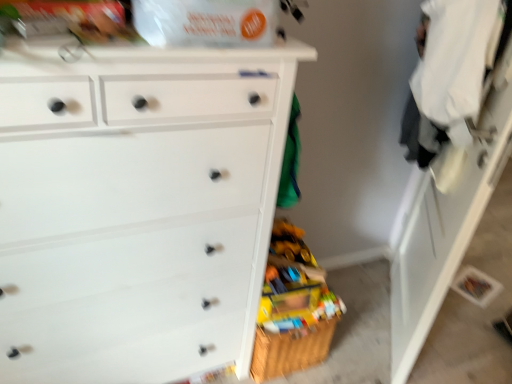
Question: In the image, is white glossy cabinet at right positioned in front of or behind white matte chest of drawers at left?

Choices:
 (A) front
 (B) behind

Answer: (B)

Question: Does point (428, 311) appear closer or farther from the camera than point (16, 54)?

Choices:
 (A) closer
 (B) farther

Answer: (B)

Question: Considering the relative positions of white glossy cabinet at right and white matte chest of drawers at left in the image provided, is white glossy cabinet at right to the left or to the right of white matte chest of drawers at left?

Choices:
 (A) left
 (B) right

Answer: (B)

Question: Considering the positions of white matte chest of drawers at left and white glossy cabinet at right in the image, is white matte chest of drawers at left bigger or smaller than white glossy cabinet at right?

Choices:
 (A) big
 (B) small

Answer: (A)

Question: Is white matte chest of drawers at left inside or outside of white glossy cabinet at right?

Choices:
 (A) outside
 (B) inside

Answer: (A)

Question: Considering the positions of white matte chest of drawers at left and white glossy cabinet at right in the image, is white matte chest of drawers at left taller or shorter than white glossy cabinet at right?

Choices:
 (A) short
 (B) tall

Answer: (A)

Question: From a real-world perspective, relative to white glossy cabinet at right, is white matte chest of drawers at left vertically above or below?

Choices:
 (A) above
 (B) below

Answer: (B)